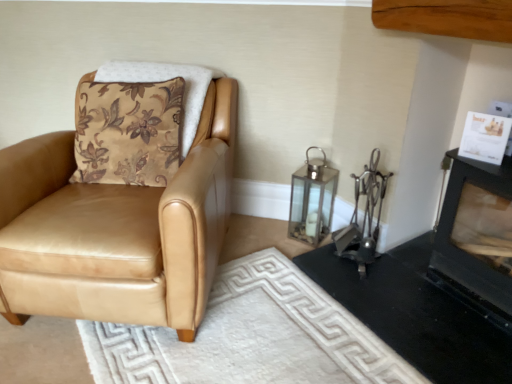
Question: Is tan leather chair at left turned away from white textured rug at lower center?

Choices:
 (A) no
 (B) yes

Answer: (A)

Question: Can you confirm if tan leather chair at left is smaller than white textured rug at lower center?

Choices:
 (A) no
 (B) yes

Answer: (A)

Question: Is tan leather chair at left taller than white textured rug at lower center?

Choices:
 (A) yes
 (B) no

Answer: (A)

Question: From a real-world perspective, is tan leather chair at left positioned over white textured rug at lower center based on gravity?

Choices:
 (A) yes
 (B) no

Answer: (A)

Question: Is tan leather chair at left oriented towards white textured rug at lower center?

Choices:
 (A) no
 (B) yes

Answer: (A)

Question: In terms of height, does black matte fireplace at upper right, placed as the second fireplace when sorted from bottom to top, look taller or shorter compared to clear glass lantern at center-right?

Choices:
 (A) short
 (B) tall

Answer: (B)

Question: From a real-world perspective, relative to clear glass lantern at center-right, is black matte fireplace at upper right, acting as the 1th fireplace starting from the top, vertically above or below?

Choices:
 (A) below
 (B) above

Answer: (B)

Question: Considering the relative positions of black matte fireplace at upper right, placed as the second fireplace when sorted from bottom to top, and clear glass lantern at center-right in the image provided, is black matte fireplace at upper right, placed as the second fireplace when sorted from bottom to top, to the left or to the right of clear glass lantern at center-right?

Choices:
 (A) left
 (B) right

Answer: (B)

Question: Considering their positions, is black matte fireplace at upper right, placed as the second fireplace when sorted from bottom to top, located in front of or behind clear glass lantern at center-right?

Choices:
 (A) behind
 (B) front

Answer: (B)

Question: In terms of height, does clear glass lantern at center-right look taller or shorter compared to white textured rug at lower center?

Choices:
 (A) short
 (B) tall

Answer: (B)

Question: Is point click(x=312, y=205) closer or farther from the camera than point click(x=312, y=304)?

Choices:
 (A) farther
 (B) closer

Answer: (A)

Question: From a real-world perspective, is clear glass lantern at center-right physically located above or below white textured rug at lower center?

Choices:
 (A) below
 (B) above

Answer: (B)

Question: Is clear glass lantern at center-right situated inside white textured rug at lower center or outside?

Choices:
 (A) inside
 (B) outside

Answer: (B)

Question: Is white textured rug at lower center inside the boundaries of clear glass lantern at center-right, or outside?

Choices:
 (A) outside
 (B) inside

Answer: (A)

Question: In the image, is white textured rug at lower center positioned in front of or behind clear glass lantern at center-right?

Choices:
 (A) behind
 (B) front

Answer: (B)